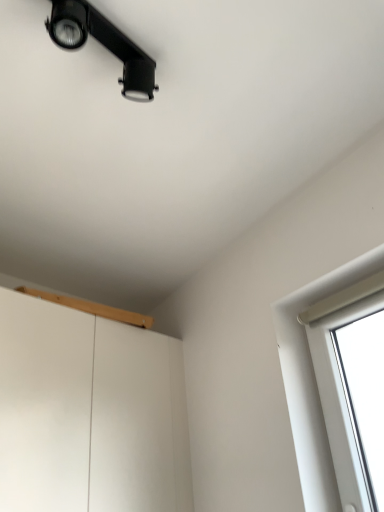
Describe the element at coordinates (92, 308) in the screenshot. I see `light wood/wooden window sill at upper center` at that location.

The width and height of the screenshot is (384, 512). I want to click on light wood/wooden window sill at upper center, so click(x=92, y=308).

At what (x,y) coordinates should I click in order to perform the action: click on black matte track light at upper left. Please return your answer as a coordinate pair (x, y). This screenshot has width=384, height=512. Looking at the image, I should click on (103, 44).

The width and height of the screenshot is (384, 512). Describe the element at coordinates (103, 44) in the screenshot. I see `black matte track light at upper left` at that location.

Locate an element on the screen. This screenshot has width=384, height=512. light wood/wooden window sill at upper center is located at coordinates (92, 308).

In the image, is light wood/wooden window sill at upper center on the left side or the right side of black matte track light at upper left?

From the image, it's evident that light wood/wooden window sill at upper center is to the left of black matte track light at upper left.

Considering the relative positions of light wood/wooden window sill at upper center and black matte track light at upper left in the image provided, is light wood/wooden window sill at upper center behind black matte track light at upper left?

Yes, it is.

Considering the points (107, 311) and (126, 86), which point is in front, point (107, 311) or point (126, 86)?

The point (126, 86) is closer to the camera.

From the image's perspective, between light wood/wooden window sill at upper center and black matte track light at upper left, who is located below?

light wood/wooden window sill at upper center, from the image's perspective.

From a real-world perspective, between light wood/wooden window sill at upper center and black matte track light at upper left, who is vertically higher?

In real-world perspective, black matte track light at upper left is above.

Between light wood/wooden window sill at upper center and black matte track light at upper left, which one has smaller width?

black matte track light at upper left.

Is light wood/wooden window sill at upper center taller than black matte track light at upper left?

No.

Looking at the image, does light wood/wooden window sill at upper center seem bigger or smaller compared to black matte track light at upper left?

Considering their sizes, light wood/wooden window sill at upper center takes up more space than black matte track light at upper left.

Is black matte track light at upper left inside light wood/wooden window sill at upper center?

No, black matte track light at upper left is not surrounded by light wood/wooden window sill at upper center.

Can you see light wood/wooden window sill at upper center touching black matte track light at upper left?

light wood/wooden window sill at upper center is not next to black matte track light at upper left, and they're not touching.

Is light wood/wooden window sill at upper center aimed at black matte track light at upper left?

No, light wood/wooden window sill at upper center is not aimed at black matte track light at upper left.

Could you measure the distance between light wood/wooden window sill at upper center and black matte track light at upper left?

The distance of light wood/wooden window sill at upper center from black matte track light at upper left is 37.36 inches.

Image resolution: width=384 pixels, height=512 pixels. What are the coordinates of `window sill on the left of black matte track light at upper left` in the screenshot? It's located at (92, 308).

Considering the positions of objects black matte track light at upper left and light wood/wooden window sill at upper center in the image provided, who is more to the left, black matte track light at upper left or light wood/wooden window sill at upper center?

Positioned to the left is light wood/wooden window sill at upper center.

Is black matte track light at upper left positioned before light wood/wooden window sill at upper center?

Yes, the depth of black matte track light at upper left is less than that of light wood/wooden window sill at upper center.

Between point (53, 0) and point (84, 302), which one is positioned in front?

The point (53, 0) is closer to the camera.

Based on the photo, from the image's perspective, is black matte track light at upper left under light wood/wooden window sill at upper center?

Actually, black matte track light at upper left appears above light wood/wooden window sill at upper center in the image.

From a real-world perspective, is black matte track light at upper left above or below light wood/wooden window sill at upper center?

From a real-world perspective, black matte track light at upper left is physically above light wood/wooden window sill at upper center.

Considering the relative sizes of black matte track light at upper left and light wood/wooden window sill at upper center in the image provided, is black matte track light at upper left wider than light wood/wooden window sill at upper center?

Incorrect, the width of black matte track light at upper left does not surpass that of light wood/wooden window sill at upper center.

Who is taller, black matte track light at upper left or light wood/wooden window sill at upper center?

With more height is black matte track light at upper left.

Does black matte track light at upper left have a larger size compared to light wood/wooden window sill at upper center?

No, black matte track light at upper left is not bigger than light wood/wooden window sill at upper center.

Is black matte track light at upper left positioned beyond the bounds of light wood/wooden window sill at upper center?

Yes, black matte track light at upper left is not within light wood/wooden window sill at upper center.

Would you say black matte track light at upper left is a long distance from light wood/wooden window sill at upper center?

No.

Is black matte track light at upper left facing towards light wood/wooden window sill at upper center?

No, black matte track light at upper left is not turned towards light wood/wooden window sill at upper center.

Can you tell me how much black matte track light at upper left and light wood/wooden window sill at upper center differ in facing direction?

The facing directions of black matte track light at upper left and light wood/wooden window sill at upper center are 0.207 degrees apart.

Measure the distance between black matte track light at upper left and light wood/wooden window sill at upper center.

A distance of 94.90 centimeters exists between black matte track light at upper left and light wood/wooden window sill at upper center.

Find the location of `window sill located underneath the black matte track light at upper left (from a real-world perspective)`. window sill located underneath the black matte track light at upper left (from a real-world perspective) is located at coordinates (92, 308).

Where is `window sill on the left side of black matte track light at upper left`? The image size is (384, 512). window sill on the left side of black matte track light at upper left is located at coordinates (92, 308).

Locate an element on the screen. lamp above the light wood/wooden window sill at upper center (from the image's perspective) is located at coordinates (103, 44).